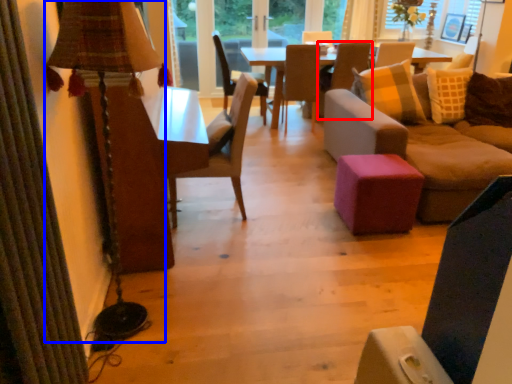
Question: Which point is further to the camera, chair (highlighted by a red box) or table lamp (highlighted by a blue box)?

Choices:
 (A) chair
 (B) table lamp

Answer: (A)